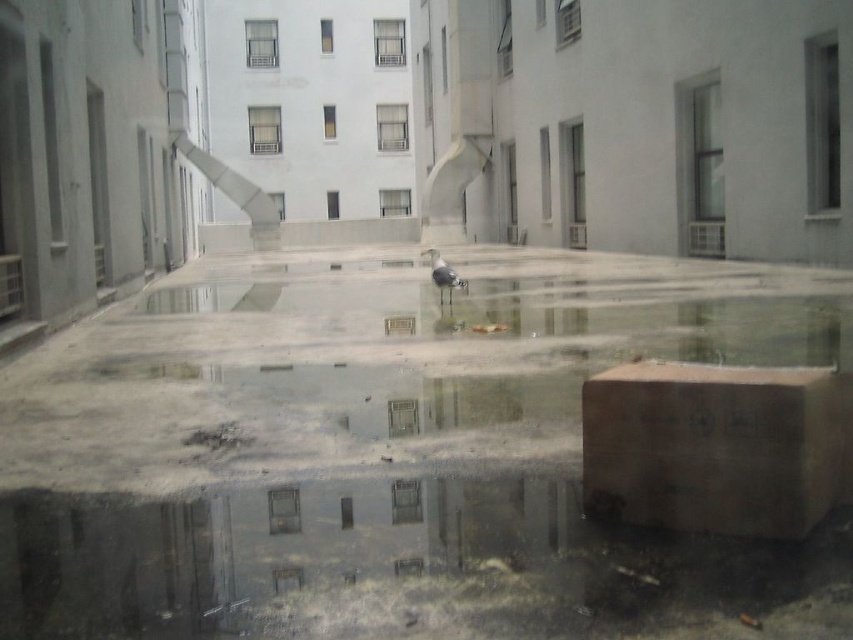
You are standing in the courtyard and want to walk from the clear concrete water at center to the brown cardboard box at lower right. Which direction should you head?

You should head to the right because the clear concrete water at center is to the left of the brown cardboard box at lower right.

From the picture: You are a delivery person trying to avoid getting your shoes wet. You see the clear concrete water at center and the brown cardboard box at lower right. Which one should you step on to stay dry?

The brown cardboard box at lower right is smaller than the clear concrete water at center, so stepping on the brown cardboard box at lower right would keep your shoes dry.

You are a delivery person trying to avoid stepping on the brown cardboard box at lower right. You need to walk from the entrance of the courtyard to the seagull in the puddle. Can you safely walk through the clear concrete water at center without stepping on the box?

The clear concrete water at center is located above the brown cardboard box at lower right, so the box is underneath the water. Therefore, you can safely walk through the clear concrete water at center without stepping on the box since the box is not in your path.